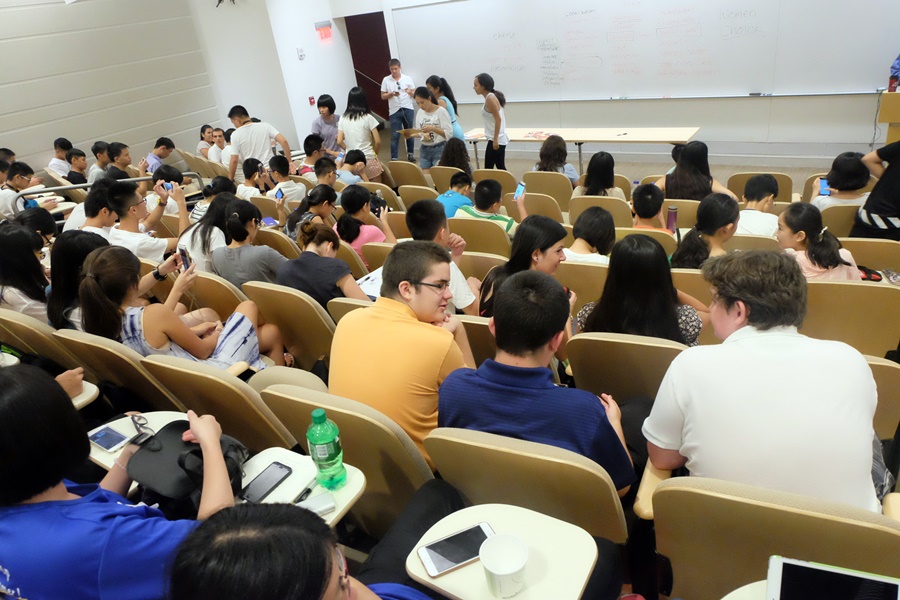
Where is `laptop`? This screenshot has height=600, width=900. laptop is located at coordinates (807, 588).